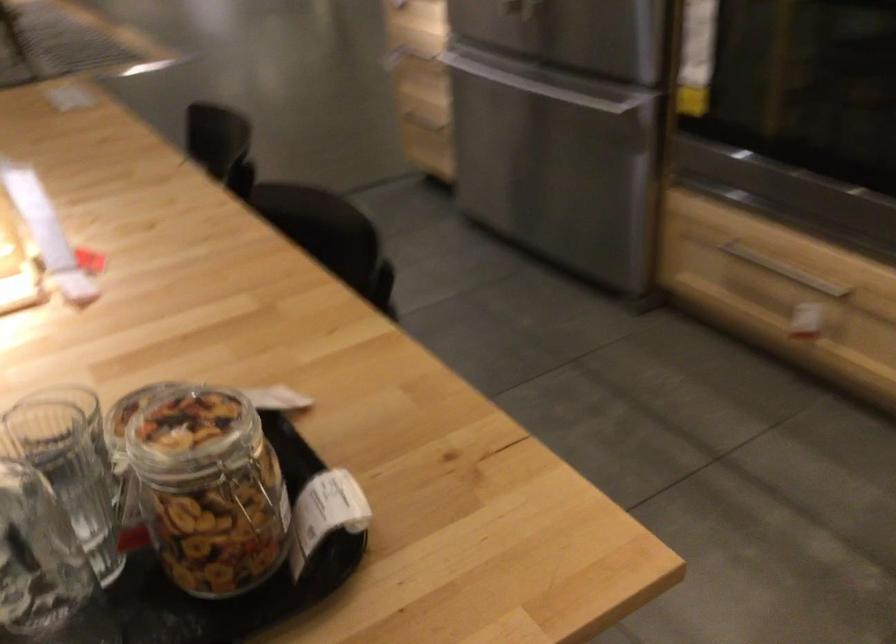
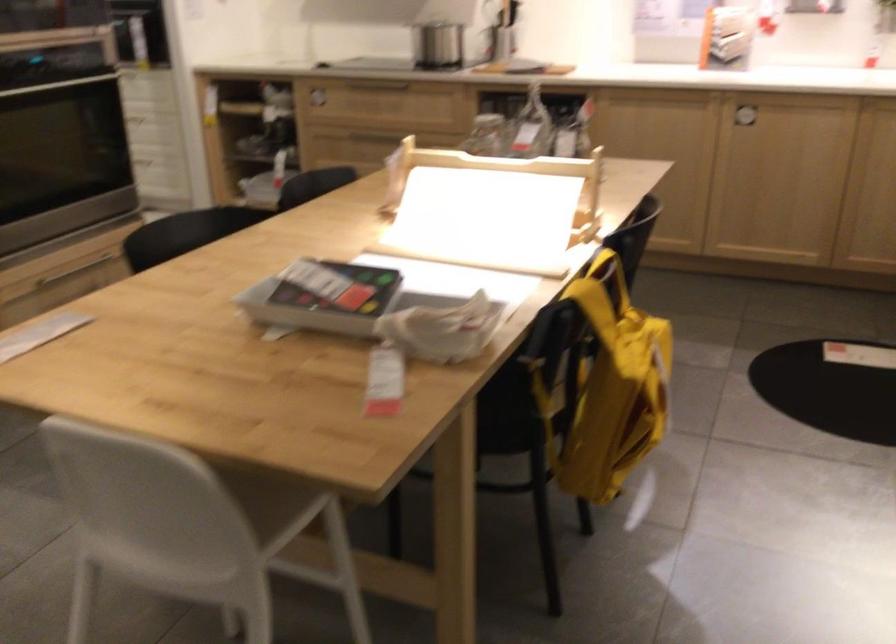
Question: I am providing you with two images of the same scene from different viewpoints. Please identify which objects are invisible in image2.

Choices:
 (A) white chair sitting surface
 (B) black tray
 (C) cabinet handle
 (D) thermostat lever

Answer: (B)